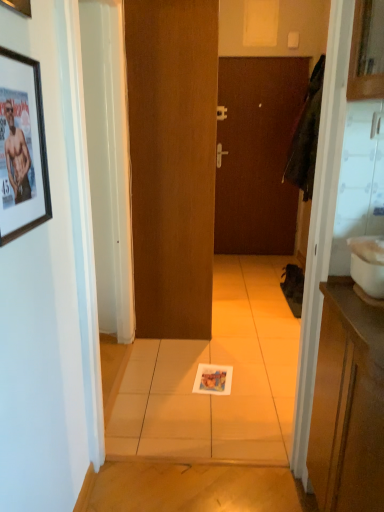
Question: Should I look upward or downward to see brown matte door at center, the first door positioned from the front?

Choices:
 (A) up
 (B) down

Answer: (A)

Question: Would you consider white glossy sink at right to be distant from brown matte door at center, positioned as the second door in left-to-right order?

Choices:
 (A) no
 (B) yes

Answer: (B)

Question: Can you confirm if white glossy sink at right is smaller than brown matte door at center, positioned as the second door in left-to-right order?

Choices:
 (A) no
 (B) yes

Answer: (B)

Question: Is white glossy sink at right taller than brown matte door at center, positioned as the second door in left-to-right order?

Choices:
 (A) yes
 (B) no

Answer: (B)

Question: Is white glossy sink at right bigger than brown matte door at center, the first door positioned from the right?

Choices:
 (A) yes
 (B) no

Answer: (B)

Question: Considering the relative sizes of white glossy sink at right and brown matte door at center, which is the 2th door in front-to-back order, in the image provided, is white glossy sink at right wider than brown matte door at center, which is the 2th door in front-to-back order,?

Choices:
 (A) yes
 (B) no

Answer: (A)

Question: Is white glossy sink at right at the left side of brown matte door at center, which is the 2th door in front-to-back order?

Choices:
 (A) yes
 (B) no

Answer: (A)

Question: Does brown matte door at center, which is the 2th door in front-to-back order, have a greater width compared to brown matte door at center, the 1th door from the left?

Choices:
 (A) no
 (B) yes

Answer: (B)

Question: Are brown matte door at center, which is the 2th door in front-to-back order, and brown matte door at center, the 1th door from the left, located far from each other?

Choices:
 (A) no
 (B) yes

Answer: (B)

Question: Can you confirm if brown matte door at center, the first door positioned from the right, is smaller than brown matte door at center, the first door positioned from the front?

Choices:
 (A) yes
 (B) no

Answer: (B)

Question: Is brown matte door at center, which is the 2th door in front-to-back order, outside brown matte door at center, the 2th door viewed from the back?

Choices:
 (A) no
 (B) yes

Answer: (B)

Question: Is brown matte door at center, which is the 2th door in front-to-back order, at the left side of brown matte door at center, the 2th door viewed from the back?

Choices:
 (A) no
 (B) yes

Answer: (A)

Question: Could you tell me if brown matte door at center, which is the 2th door in front-to-back order, is turned towards brown matte door at center, the first door positioned from the front?

Choices:
 (A) yes
 (B) no

Answer: (A)

Question: Does brown matte door at center, which is counted as the second door, starting from the right, touch white glossy sink at right?

Choices:
 (A) no
 (B) yes

Answer: (A)